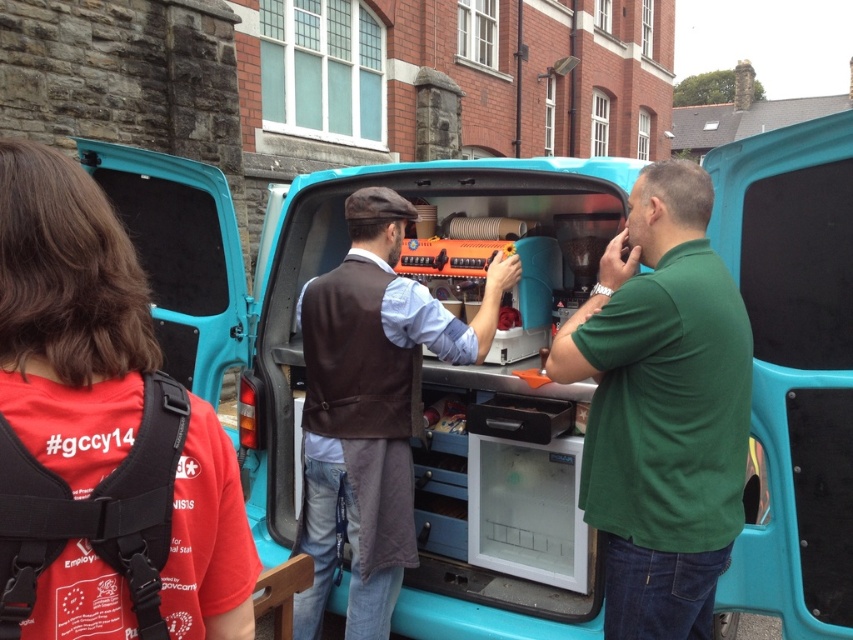
Is green matte shirt at center in front of brown leather vest at center?

Yes, it is in front of brown leather vest at center.

Can you confirm if green matte shirt at center is positioned below brown leather vest at center?

No.

Who is more distant from viewer, (650, 596) or (410, 358)?

The point (410, 358) is more distant.

At what (x,y) coordinates should I click in order to perform the action: click on green matte shirt at center. Please return your answer as a coordinate pair (x, y). Looking at the image, I should click on (662, 408).